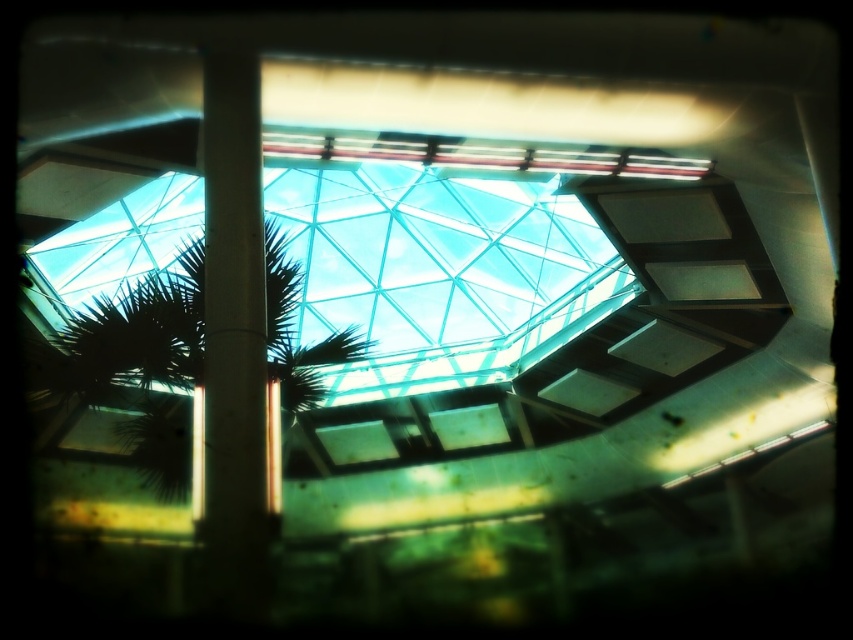
You are standing in the atrium and looking up at the glass ceiling. You see a green leafy palm tree at center and a smooth concrete pillar at center. Which object is closer to you?

The green leafy palm tree at center is closer to you because the smooth concrete pillar at center is behind it.

You are standing in the atrium and notice the green leafy palm tree at center and the smooth concrete pillar at center. Which object is positioned higher in the scene?

The smooth concrete pillar at center is positioned higher than the green leafy palm tree at center because the pillar is above the tree.

In the scene shown: You are standing in the atrium and notice the green leafy palm tree at center and the smooth concrete pillar at center. Which object appears bigger in the image?

The green leafy palm tree at center has a larger size compared to the smooth concrete pillar at center, so the palm tree appears bigger.